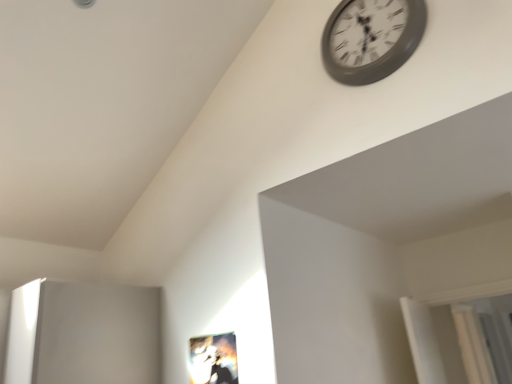
The image size is (512, 384). I want to click on metallic gray clock at upper right, so click(x=371, y=38).

Describe the element at coordinates (371, 38) in the screenshot. I see `metallic gray clock at upper right` at that location.

This screenshot has height=384, width=512. In order to click on metallic gray clock at upper right in this screenshot , I will do `click(371, 38)`.